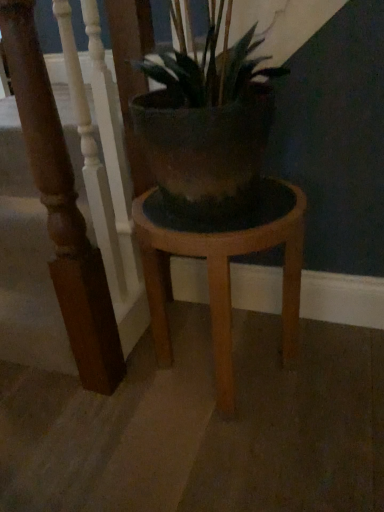
Locate an element on the screen. Image resolution: width=384 pixels, height=512 pixels. free space to the left of wooden stool at center is located at coordinates (93, 419).